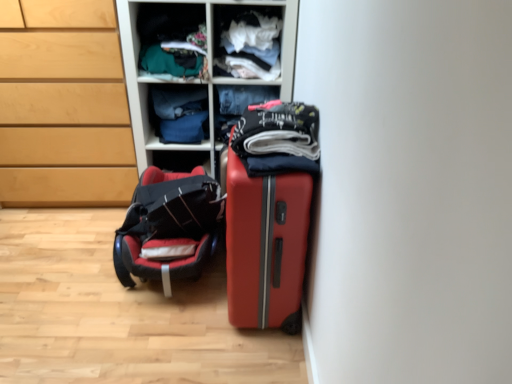
The height and width of the screenshot is (384, 512). I want to click on free location to the left of matte red suitcase at center, so click(179, 322).